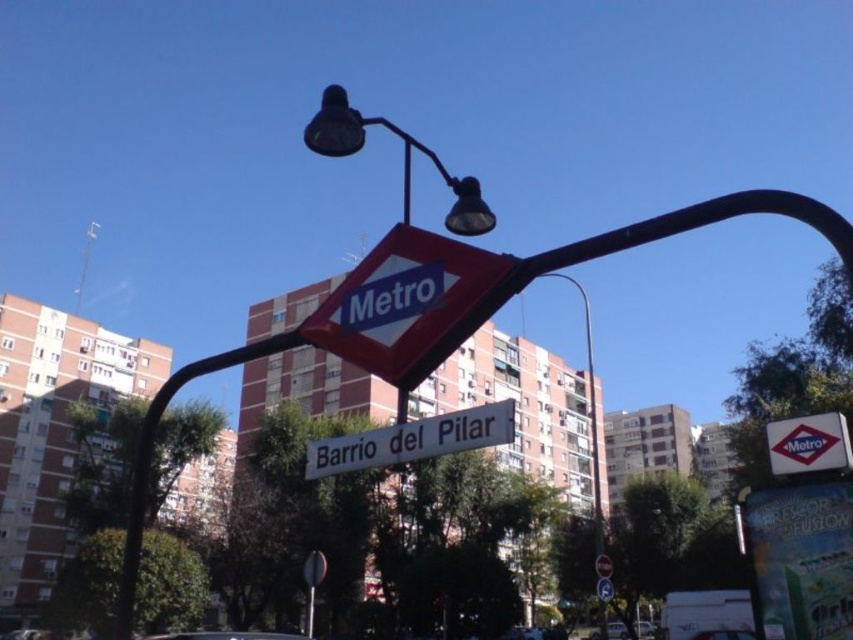
Who is higher up, blue plastic metro sign at upper center or metallic streetlight at center?

blue plastic metro sign at upper center

Which is in front, point (376, 298) or point (605, 637)?

Positioned in front is point (376, 298).

Is point (434, 340) closer to camera compared to point (579, 292)?

That is True.

Find the location of a particular element. The image size is (853, 640). blue plastic metro sign at upper center is located at coordinates (409, 305).

Which is below, white plastic street sign at center or metallic streetlight at upper center?

white plastic street sign at center

Is white plastic street sign at center taller than metallic streetlight at upper center?

No, white plastic street sign at center is not taller than metallic streetlight at upper center.

Measure the distance between white plastic street sign at center and camera.

The distance of white plastic street sign at center from camera is 3.87 meters.

The width and height of the screenshot is (853, 640). Find the location of `white plastic street sign at center`. white plastic street sign at center is located at coordinates (412, 440).

In the scene shown: Who is more forward, (x=469, y=257) or (x=596, y=593)?

Point (x=469, y=257) is in front.

Can you confirm if blue plastic metro sign at upper center is bigger than white plastic traffic sign at upper center?

No, blue plastic metro sign at upper center is not bigger than white plastic traffic sign at upper center.

Image resolution: width=853 pixels, height=640 pixels. What do you see at coordinates (409, 305) in the screenshot? I see `blue plastic metro sign at upper center` at bounding box center [409, 305].

The image size is (853, 640). Find the location of `blue plastic metro sign at upper center`. blue plastic metro sign at upper center is located at coordinates click(409, 305).